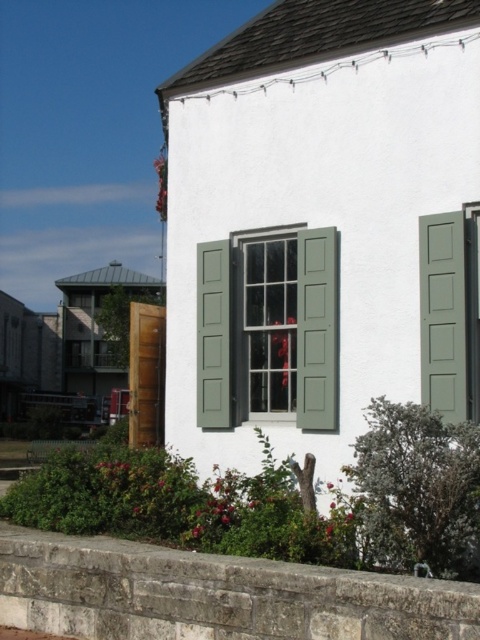
Between point (55, 557) and point (334, 396), which one is positioned in front?

Point (55, 557) is more forward.

Is point (31, 624) positioned after point (227, 244)?

No, (31, 624) is in front of (227, 244).

This screenshot has height=640, width=480. Identify the location of gray stone curb at lower left. (214, 595).